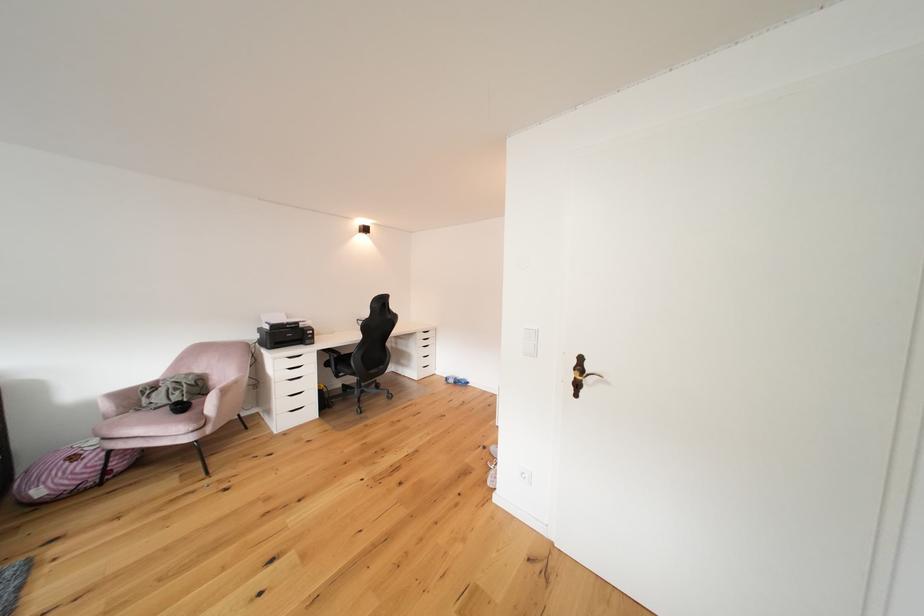
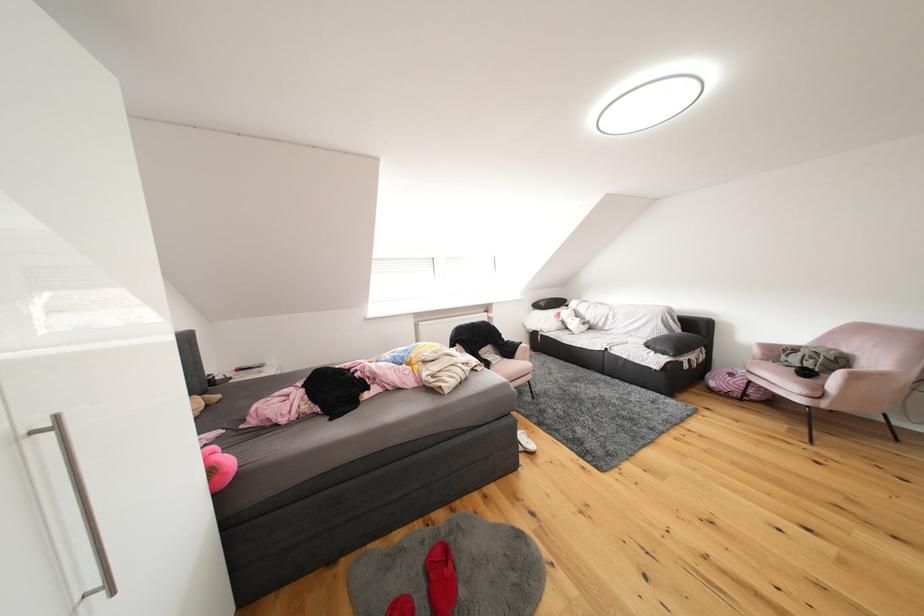
Where in the second image is the point corresponding to point 219,434 from the first image?

(834, 408)